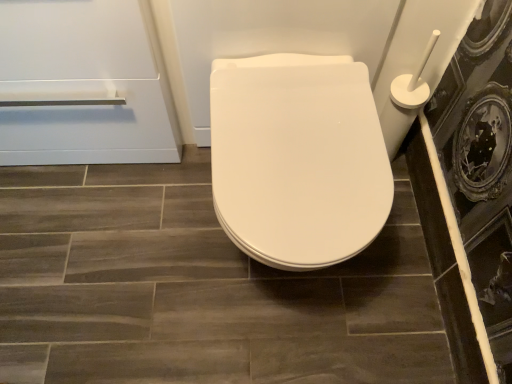
At what (x,y) coordinates should I click in order to perform the action: click on vacant space that's between white glossy toilet seat at center and transparent glass screen door at right. Please return your answer as a coordinate pair (x, y). Looking at the image, I should click on (383, 296).